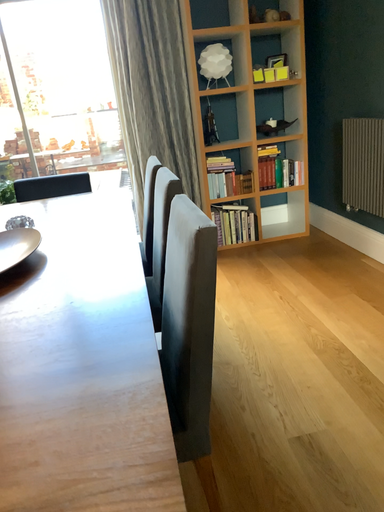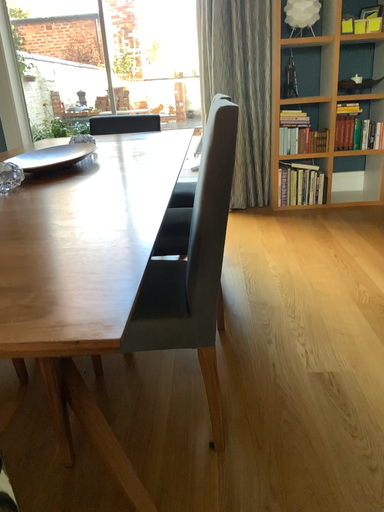
Question: Which way did the camera rotate in the video?

Choices:
 (A) rotated right
 (B) rotated left

Answer: (B)